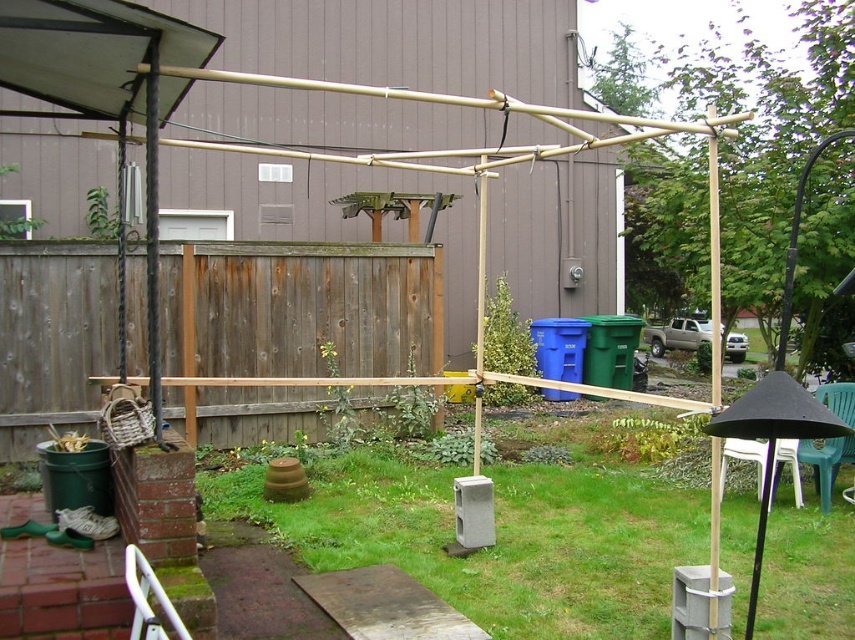
Does green plastic chair at lower right appear under white plastic chair at lower right?

Actually, green plastic chair at lower right is above white plastic chair at lower right.

Who is more forward, (x=823, y=392) or (x=729, y=442)?

Positioned in front is point (x=729, y=442).

Is point (821, 440) in front of point (771, 492)?

No.

The height and width of the screenshot is (640, 855). What are the coordinates of `green plastic chair at lower right` in the screenshot? It's located at (826, 461).

Which is more to the right, green grass at center or green plastic chair at lower right?

green plastic chair at lower right

Does green grass at center come in front of green plastic chair at lower right?

Yes, green grass at center is in front of green plastic chair at lower right.

Is point (357, 461) less distant than point (842, 394)?

No, it is not.

I want to click on green grass at center, so click(496, 538).

Which is above, green grass at center or wooden fence at center?

wooden fence at center is above.

Is point (531, 550) positioned before point (174, 365)?

Yes, point (531, 550) is in front of point (174, 365).

What do you see at coordinates (496, 538) in the screenshot?
I see `green grass at center` at bounding box center [496, 538].

Identify the location of green grass at center. This screenshot has width=855, height=640. (496, 538).